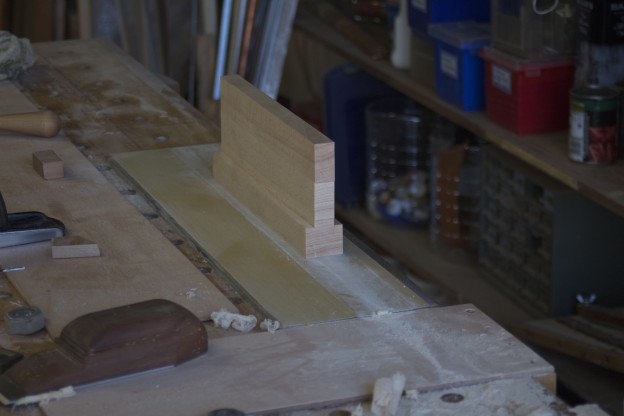
Find the location of a particular element. This screenshot has height=416, width=624. plastic boxes is located at coordinates (456, 85), (508, 105), (520, 22), (427, 8).